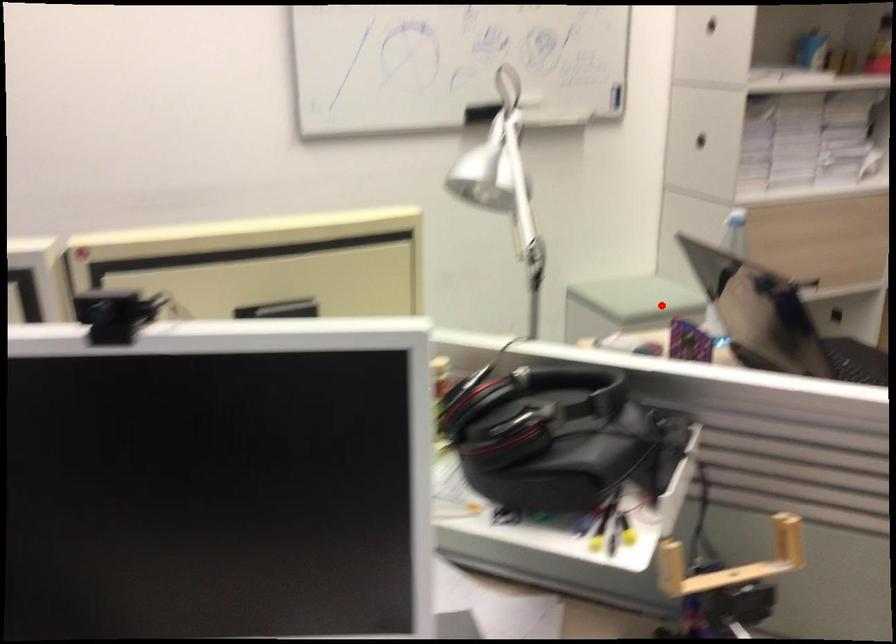
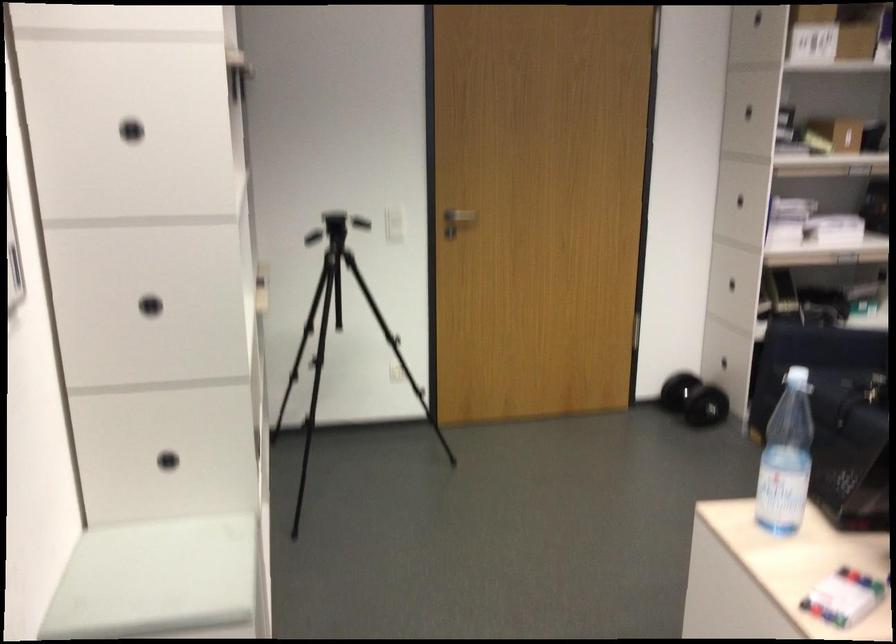
Question: I am providing you with two images of the same scene from different viewpoints. In image1, a red point is highlighted. Considering the same 3D point in image2, which of the following is correct?

Choices:
 (A) It is closer
 (B) It is farther

Answer: (A)